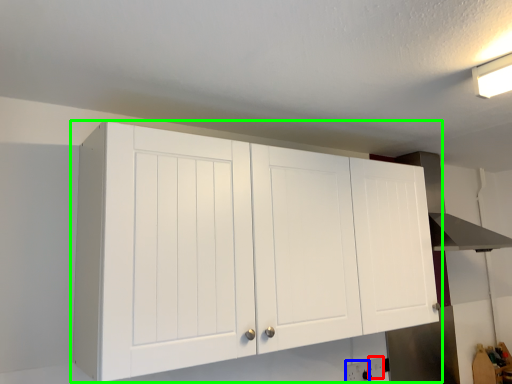
Question: Based on their relative distances, which object is nearer to electric outlet (highlighted by a red box)? Choose from electric outlet (highlighted by a blue box) and cupboard (highlighted by a green box).

Choices:
 (A) electric outlet
 (B) cupboard

Answer: (A)